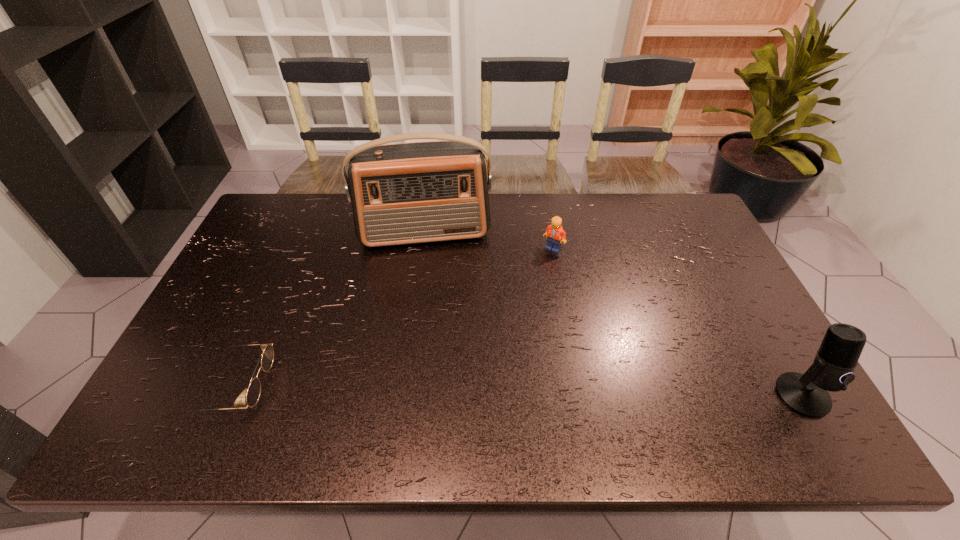
You are a GUI agent. You are given a task and a screenshot of the screen. Output one action in this format:
    pyautogui.click(x=<x>, y=<y>)
    Task: Click on the vacant space that satisfies the following two spatial constraints: 1. on the front side of the tallest object; 2. on the right side of the Lego
    The width and height of the screenshot is (960, 540).
    Given the screenshot: What is the action you would take?
    pyautogui.click(x=423, y=248)